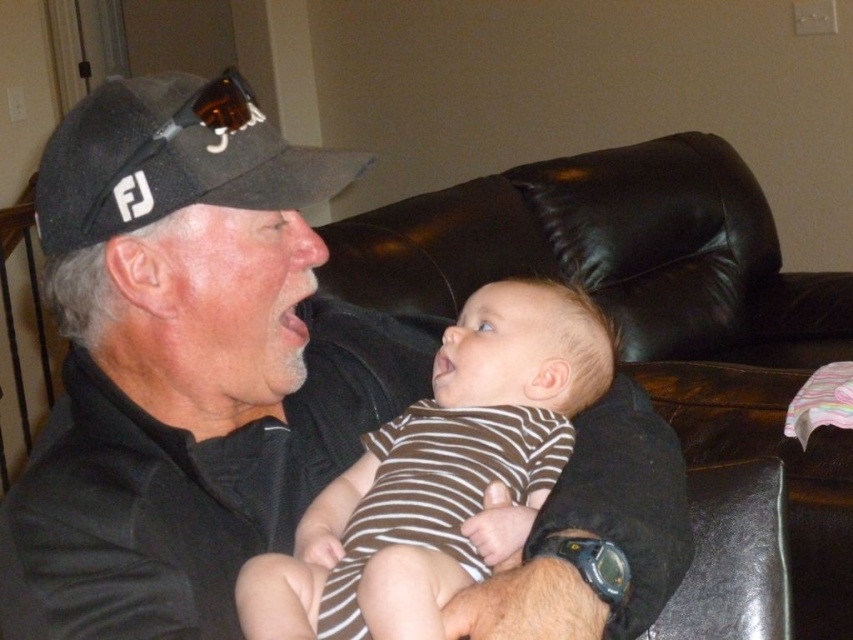
Where is the black leather couch at center located in the image?

The black leather couch at center is located at point 0.487 on the x axis and 0.763 on the y axis.